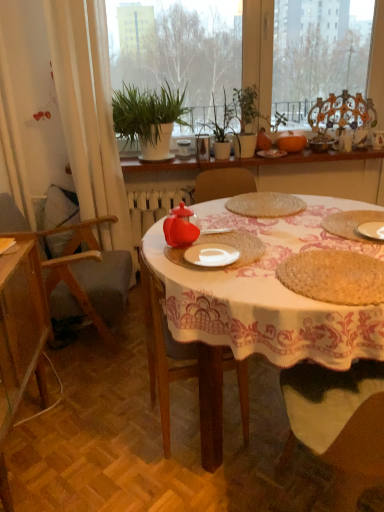
The height and width of the screenshot is (512, 384). I want to click on unoccupied area in front of matte glass teapot at center, so click(185, 267).